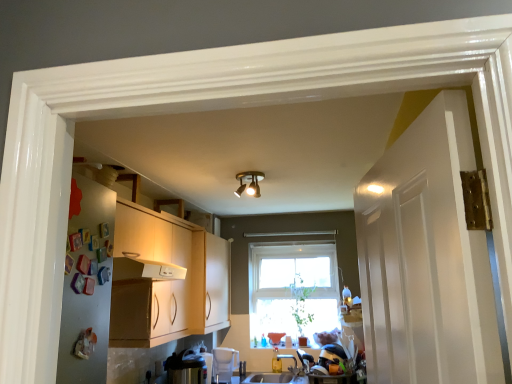
Question: Does gold metallic light fixture at center come behind clear glass window at center?

Choices:
 (A) no
 (B) yes

Answer: (A)

Question: Considering the relative sizes of gold metallic light fixture at center and clear glass window at center in the image provided, is gold metallic light fixture at center thinner than clear glass window at center?

Choices:
 (A) no
 (B) yes

Answer: (A)

Question: Considering the relative sizes of gold metallic light fixture at center and clear glass window at center in the image provided, is gold metallic light fixture at center wider than clear glass window at center?

Choices:
 (A) yes
 (B) no

Answer: (A)

Question: Is gold metallic light fixture at center positioned far away from clear glass window at center?

Choices:
 (A) no
 (B) yes

Answer: (B)

Question: Does gold metallic light fixture at center lie in front of clear glass window at center?

Choices:
 (A) no
 (B) yes

Answer: (B)

Question: Considering the positions of point (212, 359) and point (283, 297), is point (212, 359) closer or farther from the camera than point (283, 297)?

Choices:
 (A) closer
 (B) farther

Answer: (A)

Question: Would you say white plastic water filter at lower center, the second appliance in the left-to-right sequence, is to the left or to the right of clear glass window at center in the picture?

Choices:
 (A) left
 (B) right

Answer: (A)

Question: Is white plastic water filter at lower center, the second appliance in the left-to-right sequence, inside or outside of clear glass window at center?

Choices:
 (A) outside
 (B) inside

Answer: (A)

Question: Considering the positions of white plastic water filter at lower center, placed as the 1th appliance when sorted from back to front, and clear glass window at center in the image, is white plastic water filter at lower center, placed as the 1th appliance when sorted from back to front, wider or thinner than clear glass window at center?

Choices:
 (A) wide
 (B) thin

Answer: (A)

Question: Is clear glass window at center spatially inside white plastic water filter at lower center, the first appliance in the right-to-left sequence, or outside of it?

Choices:
 (A) outside
 (B) inside

Answer: (A)

Question: Visually, is clear glass window at center positioned to the left or to the right of white plastic water filter at lower center, the second appliance in the left-to-right sequence?

Choices:
 (A) right
 (B) left

Answer: (A)

Question: From a real-world perspective, is clear glass window at center positioned above or below white plastic water filter at lower center, placed as the 1th appliance when sorted from back to front?

Choices:
 (A) above
 (B) below

Answer: (A)

Question: In terms of width, does clear glass window at center look wider or thinner when compared to white plastic water filter at lower center, placed as the 1th appliance when sorted from back to front?

Choices:
 (A) wide
 (B) thin

Answer: (B)

Question: Looking at the image, does satin silver toaster at lower left, which is the 2th appliance from back to front, seem bigger or smaller compared to clear glass window at center?

Choices:
 (A) big
 (B) small

Answer: (B)

Question: Considering their positions, is satin silver toaster at lower left, marked as the 1th appliance in a left-to-right arrangement, located in front of or behind clear glass window at center?

Choices:
 (A) behind
 (B) front

Answer: (B)